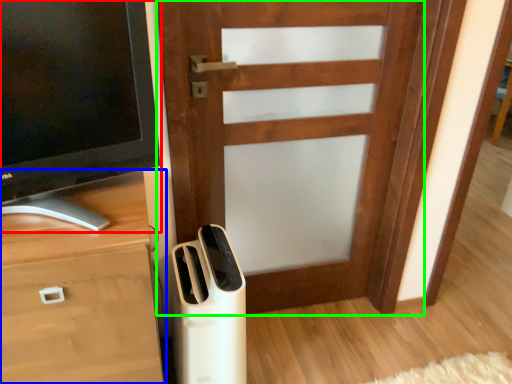
Question: Which object is positioned farthest from television (highlighted by a red box)? Select from chest of drawers (highlighted by a blue box) and door (highlighted by a green box).

Choices:
 (A) chest of drawers
 (B) door

Answer: (B)